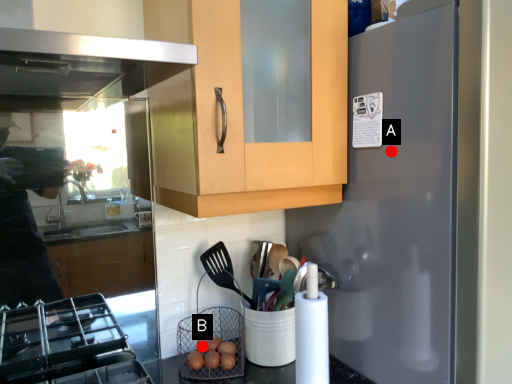
Question: Two points are circled on the image, labeled by A and B beside each circle. Which point appears closest to the camera in this image?

Choices:
 (A) A is closer
 (B) B is closer

Answer: (A)